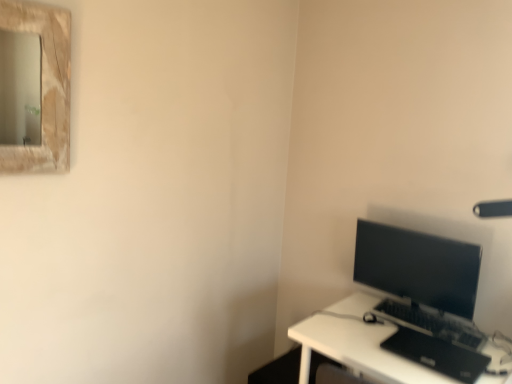
Where is `free space that is in between matte black monitor at right and black matte laptop at lower right`? free space that is in between matte black monitor at right and black matte laptop at lower right is located at coordinates [x=374, y=322].